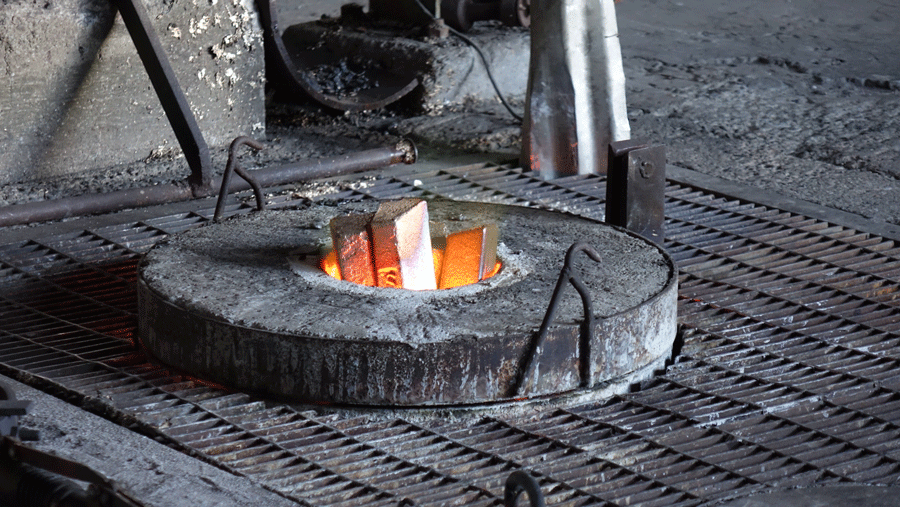
The image size is (900, 507). I want to click on cable, so click(x=486, y=63).